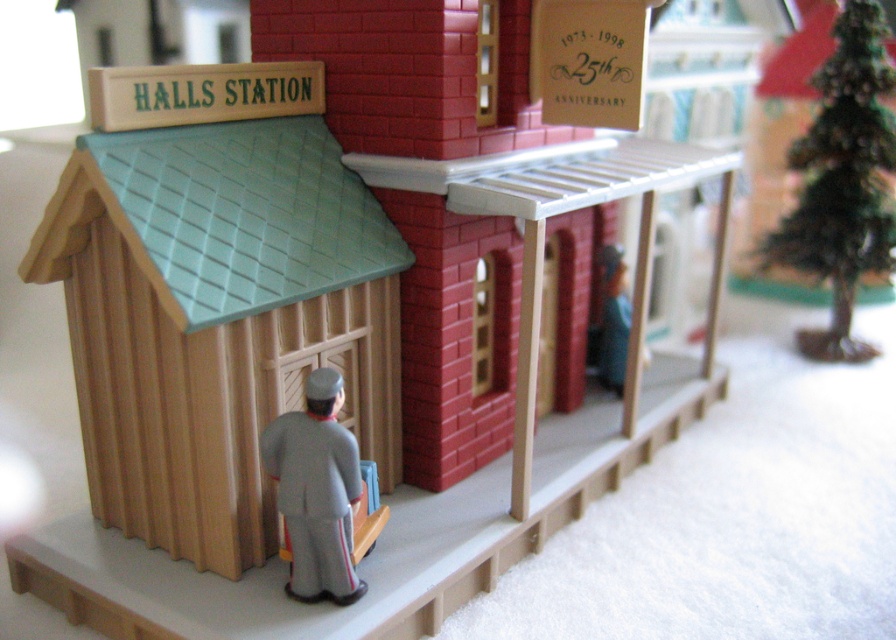
Question: Can you confirm if green matte christmas tree at right is smaller than gray fabric uniform at center?

Choices:
 (A) no
 (B) yes

Answer: (A)

Question: Among these points, which one is nearest to the camera?

Choices:
 (A) (860, 145)
 (B) (341, 388)

Answer: (B)

Question: Is green matte christmas tree at right wider than gray fabric uniform at center?

Choices:
 (A) no
 (B) yes

Answer: (B)

Question: Among these objects, which one is nearest to the camera?

Choices:
 (A) green matte christmas tree at right
 (B) gray fabric uniform at center

Answer: (B)

Question: Is green matte christmas tree at right positioned before gray fabric uniform at center?

Choices:
 (A) yes
 (B) no

Answer: (B)